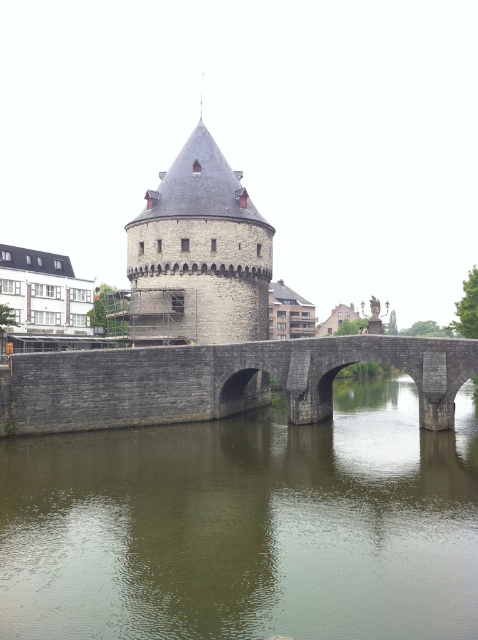
You are a tourist standing on the gray stone bridge at center and want to take a photo of the gray stone tower at center. Which direction should you face to ensure the tower is fully visible in your shot?

The gray stone bridge at center is below the gray stone tower at center, so you should face upward to ensure the tower is fully visible in your shot.

You are standing on the gray stone bridge at center and looking towards the greenish stone water at center. Which direction should you walk to reach the water?

The greenish stone water at center is to the left of the gray stone bridge at center, so you should walk to the left to reach the water.

You are an architect analyzing the composition of the image. Where is the gray stone bridge at center positioned in terms of its 2D coordinates?

The gray stone bridge at center is positioned at the 2D coordinates of point (x=217, y=381).